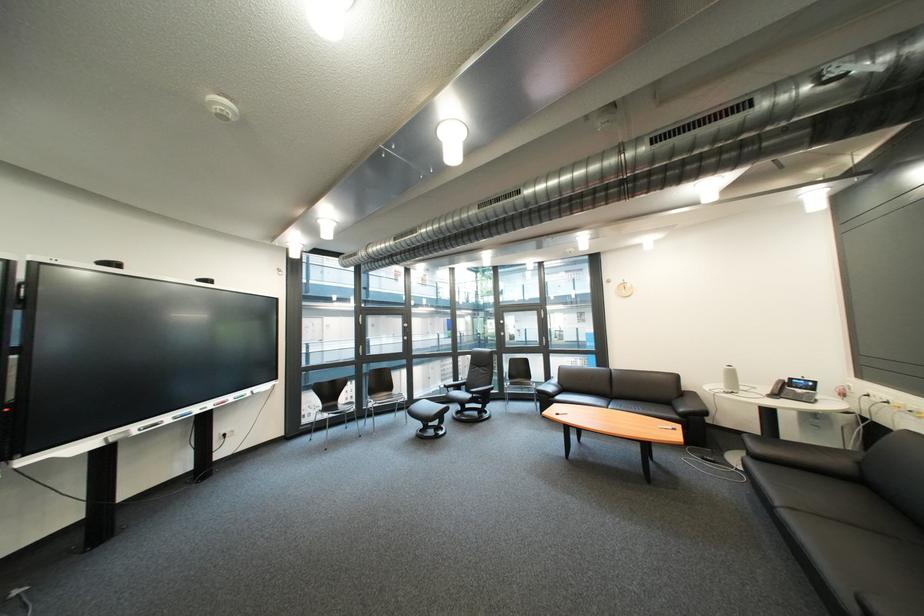
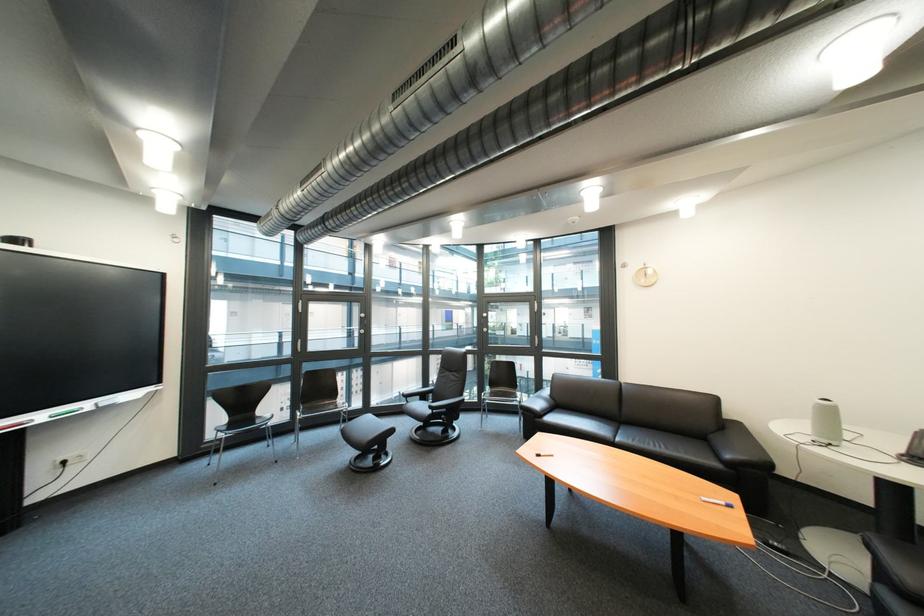
Find the pixel in the second image that matches pixel 261 394 in the first image.

(101, 406)